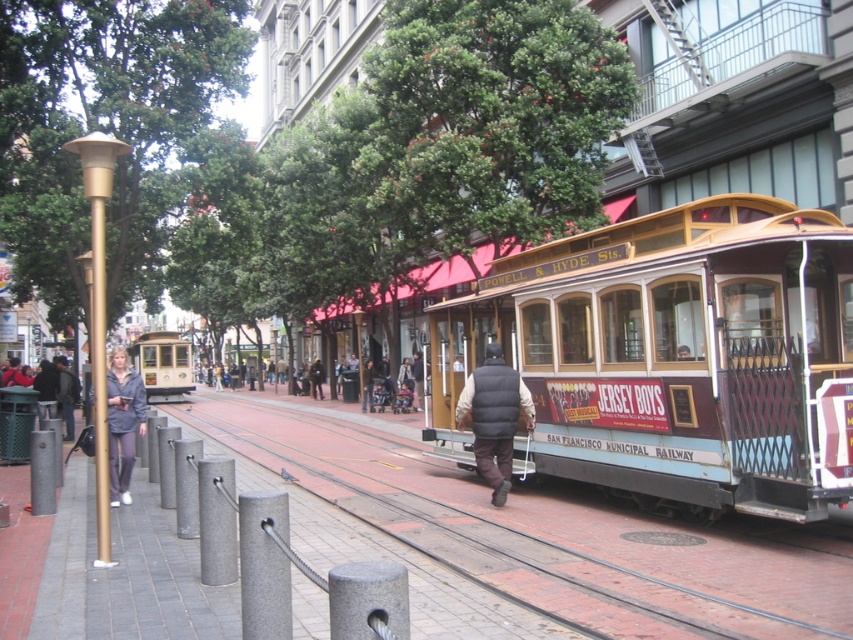
You are a fashion designer observing the urban street scene. You notice the black puffy vest at center and the gray fabric jacket at lower left. Which piece of clothing is located more to the right in the scene?

The black puffy vest at center is positioned on the right side of the gray fabric jacket at lower left, so it is more to the right.

You are a fashion designer observing the urban scene. You notice two jackets displayed on mannequins outside a boutique. The jackets are the dark gray jacket at left and the dark brown leather jacket at center. Which jacket appears taller in the scene?

The dark gray jacket at left appears taller than the dark brown leather jacket at center in the scene.

You are a photographer standing on the sidewalk next to the cable car tracks. You want to take a photo of both the black puffy vest at center and the gray fabric jacket at lower left. Which item will appear larger in your photo?

The black puffy vest at center will appear larger in the photo since it is closer to the viewer than the gray fabric jacket at lower left.